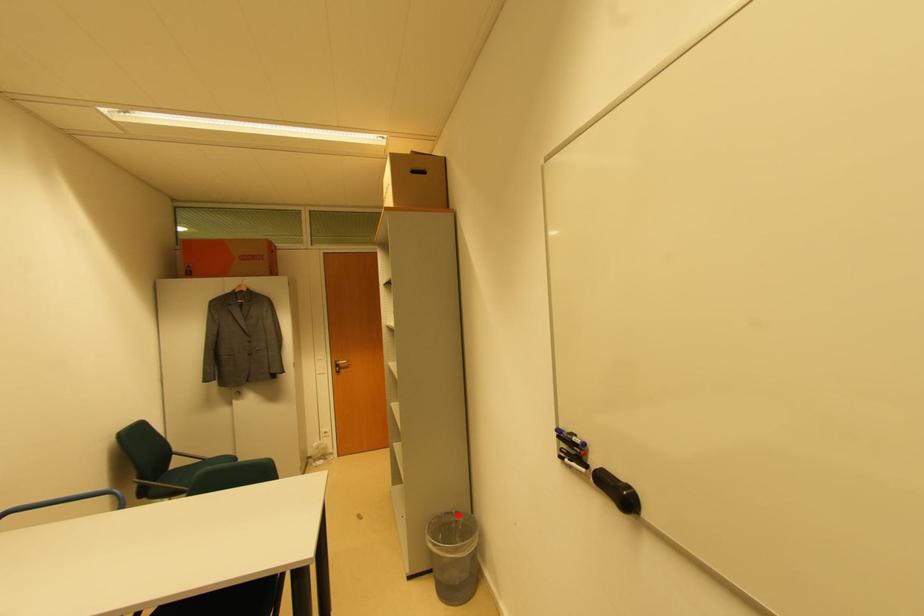
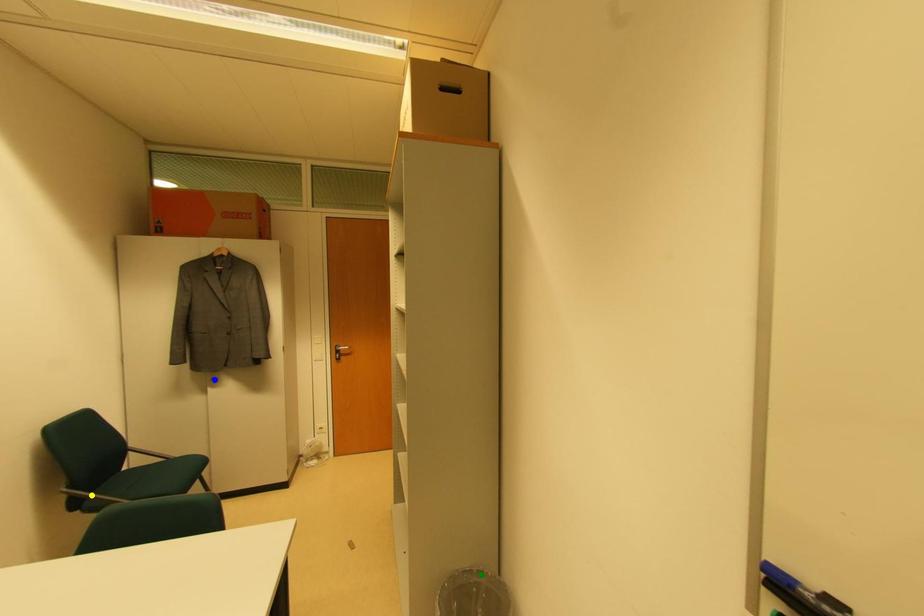
Question: I am providing you with two images of the same scene from different viewpoints. A red point is marked on the first image. You are given multiple points on the second image. Which point in image 2 represents the same 3d spot as the red point in image 1?

Choices:
 (A) yellow point
 (B) blue point
 (C) green point

Answer: (C)